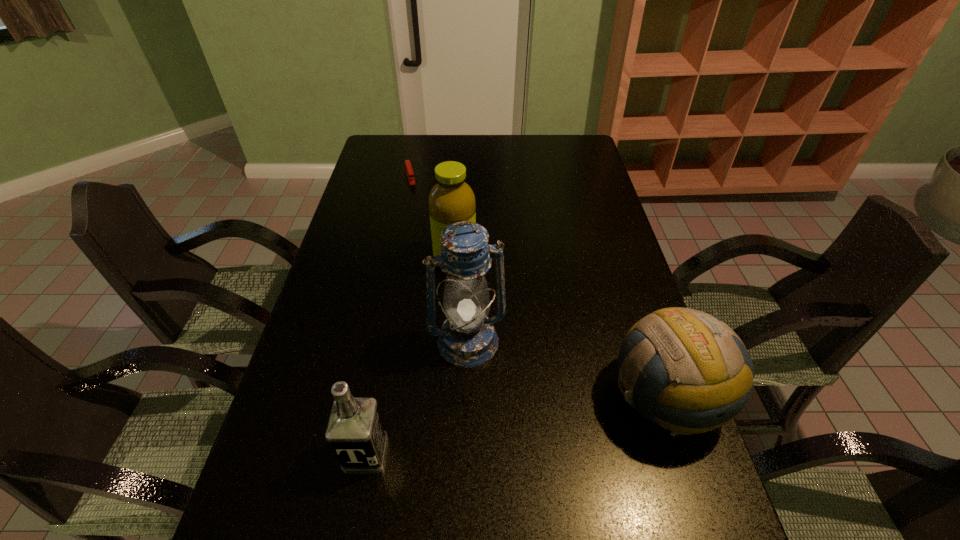
You are a GUI agent. You are given a task and a screenshot of the screen. Output one action in this format:
    pyautogui.click(x=<x>, y=<y>)
    Task: Click on the vacant space situated 0.390m on the front label of the fruit juice
    
    Given the screenshot: What is the action you would take?
    pyautogui.click(x=509, y=386)

At what (x,y) coordinates should I click in order to perform the action: click on vacant space located on the front label of the fruit juice. Please return your answer as a coordinate pair (x, y). Looking at the image, I should click on (507, 382).

You are a GUI agent. You are given a task and a screenshot of the screen. Output one action in this format:
    pyautogui.click(x=<x>, y=<y>)
    Task: Click on the vacant region located 0.100m on the front-facing side of the stapler
    
    Given the screenshot: What is the action you would take?
    pyautogui.click(x=415, y=200)

Where is `vacant space located 0.140m on the front-facing side of the stapler`? The height and width of the screenshot is (540, 960). vacant space located 0.140m on the front-facing side of the stapler is located at coordinates (417, 206).

I want to click on vacant area situated 0.260m on the front-facing side of the stapler, so click(422, 227).

Where is `free space located 0.110m on the front-facing side of the tallest object`? free space located 0.110m on the front-facing side of the tallest object is located at coordinates (492, 406).

Locate an element on the screen. The height and width of the screenshot is (540, 960). vacant space situated 0.340m on the front-facing side of the tallest object is located at coordinates coord(529,511).

Where is `vacant area situated 0.120m on the front-facing side of the tallest object`? Image resolution: width=960 pixels, height=540 pixels. vacant area situated 0.120m on the front-facing side of the tallest object is located at coordinates (493, 410).

You are a GUI agent. You are given a task and a screenshot of the screen. Output one action in this format:
    pyautogui.click(x=<x>, y=<y>)
    Task: Click on the object that is at the left edge
    The width and height of the screenshot is (960, 540).
    Given the screenshot: What is the action you would take?
    pyautogui.click(x=409, y=171)

Locate an element on the screen. object positioned at the right edge is located at coordinates (699, 368).